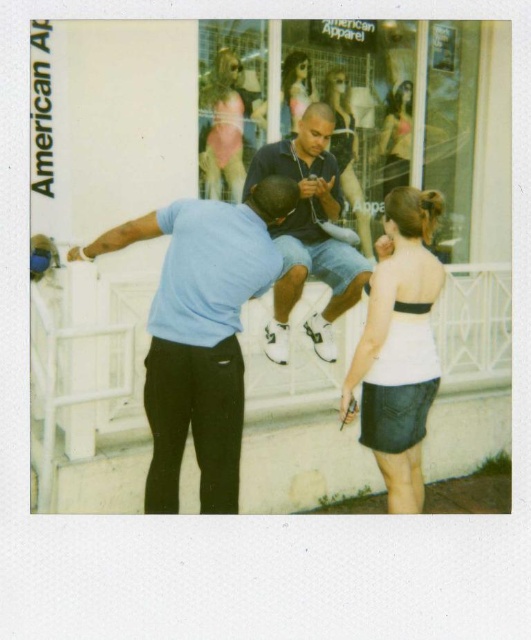
Is transparent glass shop window at center smaller than matte black dress at upper center?

Actually, transparent glass shop window at center might be larger than matte black dress at upper center.

Does point (375, 177) come in front of point (387, 104)?

No, it is not.

Which is behind, point (226, 186) or point (397, 136)?

Point (397, 136)

The image size is (531, 640). What are the coordinates of `transparent glass shop window at center` in the screenshot? It's located at (397, 112).

Does white matte storefront at center lie in front of white strapless top at center?

Yes.

Does point (354, 307) come in front of point (389, 326)?

That is False.

Find the location of a particular element. white matte storefront at center is located at coordinates (278, 138).

Is the position of white matte storefront at center more distant than that of dark blue denim shorts at center?

No, it is in front of dark blue denim shorts at center.

Between white matte storefront at center and dark blue denim shorts at center, which one has less height?

white matte storefront at center

Where is `white matte storefront at center`? white matte storefront at center is located at coordinates (278, 138).